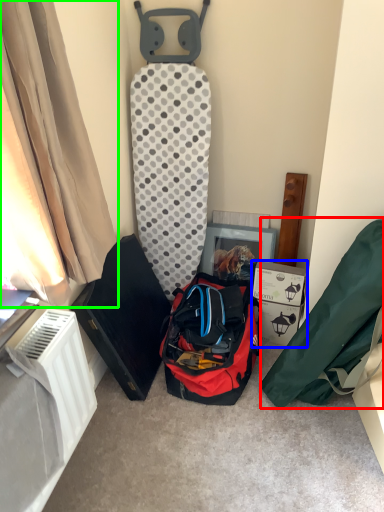
Question: Considering the real-world distances, which object is closest to kit (highlighted by a red box)? cardboard box (highlighted by a blue box) or curtain (highlighted by a green box).

Choices:
 (A) cardboard box
 (B) curtain

Answer: (A)